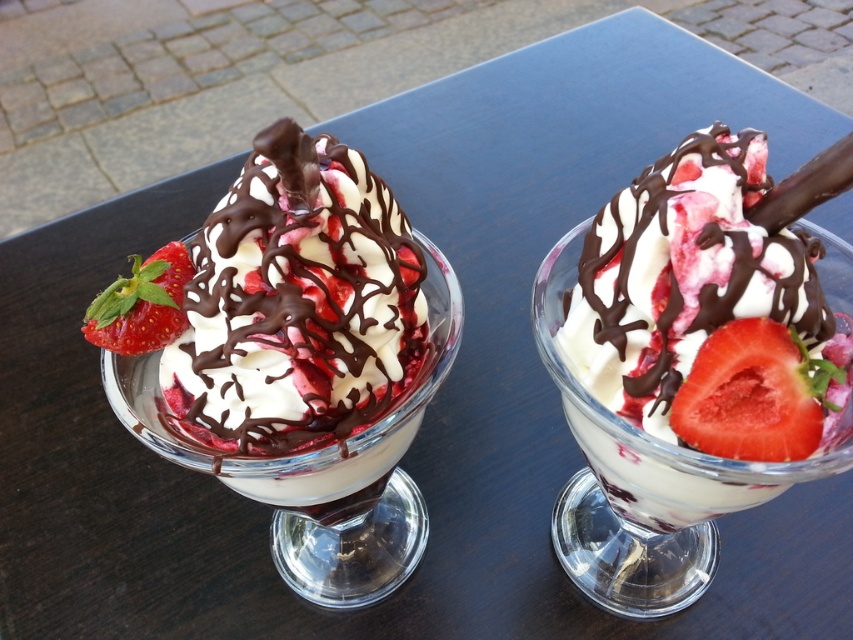
You are at a dessert buffet and want to choose between the white creamy ice cream at center and the juicy red strawberry at right. Which one is bigger?

The white creamy ice cream at center is larger in size compared to the juicy red strawberry at right.

You are a food stylist arranging desserts on a table. You have a white glossy ice cream sundae at center and a red matte strawberry at left. The client wants to know if the strawberry can be moved closer to the sundae without touching it. The minimum safe distance is 1 inch. Can the strawberry be moved closer?

The white glossy ice cream sundae at center is currently 1.55 inches from the red matte strawberry at left. Since the minimum safe distance is 1 inch, the strawberry can be moved closer as the current distance exceeds the required minimum.